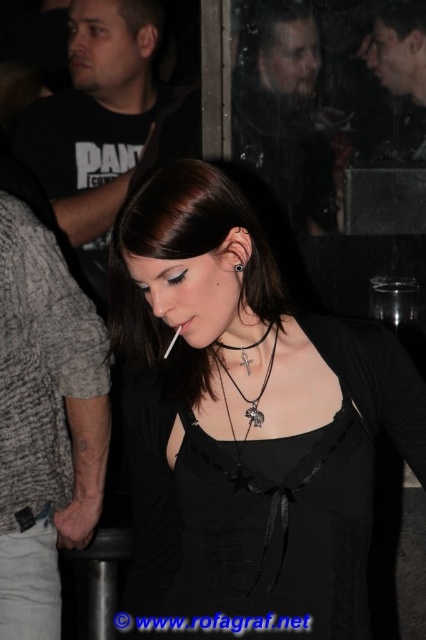
You are a GUI agent. You are given a task and a screenshot of the screen. Output one action in this format:
    pyautogui.click(x=<x>, y=<y>)
    Task: Click on the matte black dress at center
    The height and width of the screenshot is (640, 426).
    Given the screenshot: What is the action you would take?
    pyautogui.click(x=247, y=417)

Does matte black dress at center appear under matte black lipstick at center?

Yes.

Where is `matte black dress at center`? This screenshot has height=640, width=426. matte black dress at center is located at coordinates (247, 417).

Locate an element on the screen. This screenshot has height=640, width=426. matte black dress at center is located at coordinates (247, 417).

Between matte black dress at center and black leather necklace with cross pendant at center, which one is positioned higher?

black leather necklace with cross pendant at center

Does matte black dress at center have a smaller size compared to black leather necklace with cross pendant at center?

Incorrect, matte black dress at center is not smaller in size than black leather necklace with cross pendant at center.

Is point (175, 356) closer to viewer compared to point (256, 408)?

No, (175, 356) is behind (256, 408).

I want to click on matte black dress at center, so click(247, 417).

Is black leather necklace with cross pendant at center positioned at the back of matte black lipstick at center?

Yes, black leather necklace with cross pendant at center is behind matte black lipstick at center.

From the picture: Who is taller, black leather necklace with cross pendant at center or matte black lipstick at center?

Standing taller between the two is black leather necklace with cross pendant at center.

Find the location of a particular element. This screenshot has height=640, width=426. black leather necklace with cross pendant at center is located at coordinates coord(241,390).